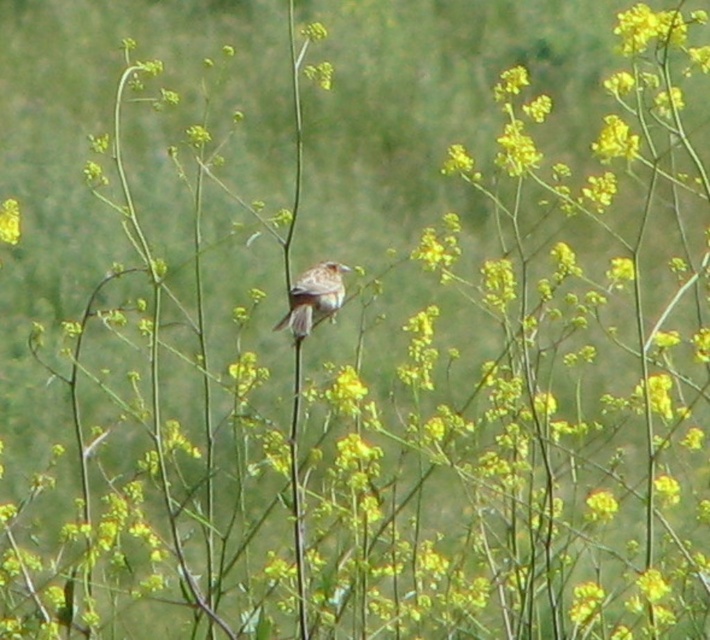
You are standing in the field of yellow flowers and see two points marked in the image. Which point is closer to you, point (337,289) or point (11,204)?

Point (337,289) is in front of point (11,204), so it is closer to you.

You are a photographer aiming to capture a closeup of the brown feathered bird at center and the yellow matte flower at center. Based on their sizes, which one will appear larger in your photo?

The brown feathered bird at center is taller than the yellow matte flower at center, so it will appear larger in the photo.

You are a photographer trying to capture a clear shot of the brown feathered bird at center and the yellow matte flower at center. Since you want both subjects in focus, will adjusting the camera focus to the bird ensure the flower is also in focus?

The brown feathered bird at center is closer to the viewer than the yellow matte flower at center. Adjusting focus to the bird will likely leave the flower slightly out of focus since it is further away. To get both in focus, adjust focus to a point between them or use a smaller aperture for deeper depth of field.